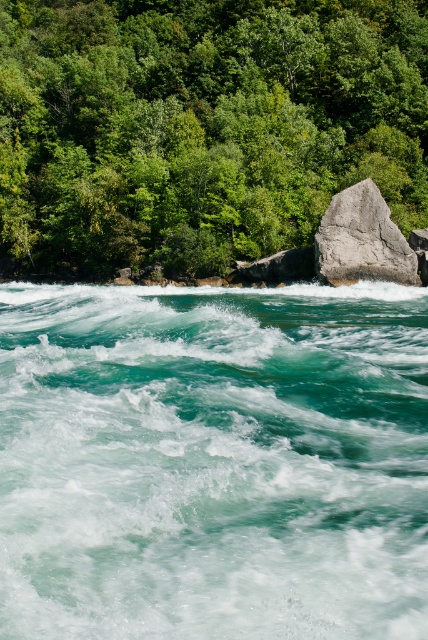
Measure the distance between turquoise frothy water at center and camera.

turquoise frothy water at center is 8.56 feet from camera.

Where is `turquoise frothy water at center`? turquoise frothy water at center is located at coordinates (213, 461).

Does turquoise frothy water at center have a lesser width compared to green leafy trees at upper center?

Correct, turquoise frothy water at center's width is less than green leafy trees at upper center's.

Between turquoise frothy water at center and green leafy trees at upper center, which one is positioned higher?

green leafy trees at upper center

At what (x,y) coordinates should I click in order to perform the action: click on turquoise frothy water at center. Please return your answer as a coordinate pair (x, y). Looking at the image, I should click on (213, 461).

Who is more forward, [294,100] or [407,276]?

Point [407,276]

Can you confirm if green leafy trees at upper center is positioned above gray rough rock at center?

Indeed, green leafy trees at upper center is positioned over gray rough rock at center.

Between point (394, 65) and point (372, 214), which one is positioned in front?

Positioned in front is point (372, 214).

Image resolution: width=428 pixels, height=640 pixels. Identify the location of green leafy trees at upper center. 202,125.